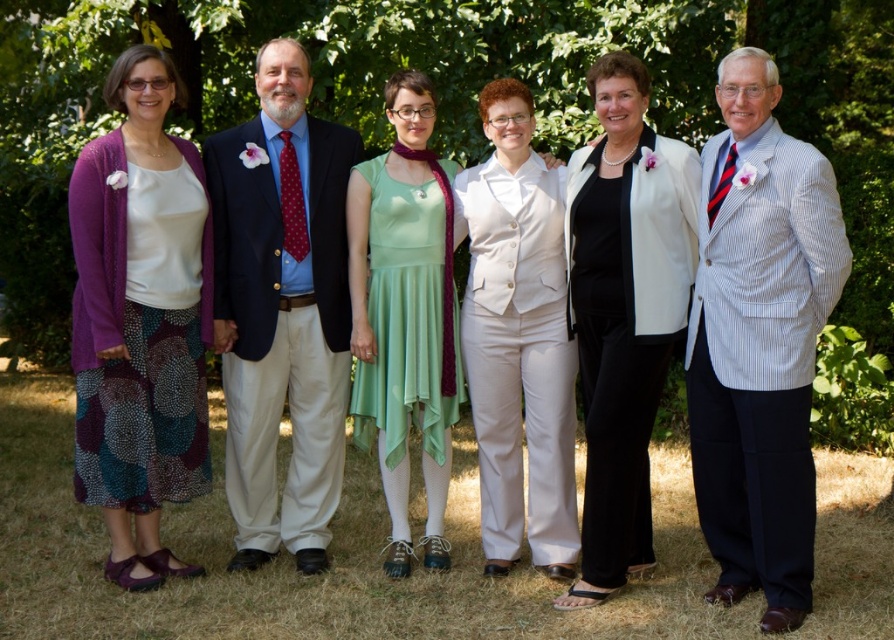
You are a photographer planning to take a group photo of the six people in the garden. You notice two white items at the center of the group. What is the relationship between the widths of the white matte blazer at center and the white smooth vest at center?

The white matte blazer at center is wider than the white smooth vest at center.